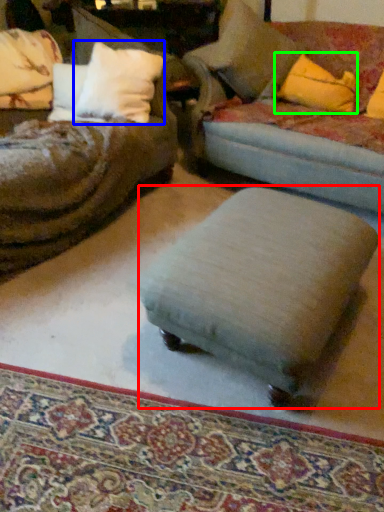
Question: Which object is positioned farthest from stool (highlighted by a red box)? Select from pillow (highlighted by a blue box) and throw pillow (highlighted by a green box).

Choices:
 (A) pillow
 (B) throw pillow

Answer: (B)